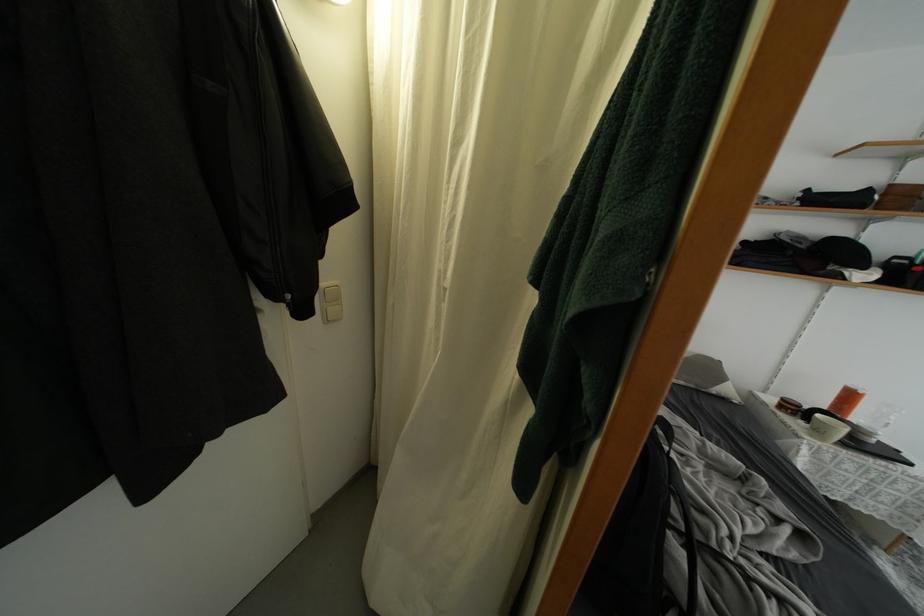
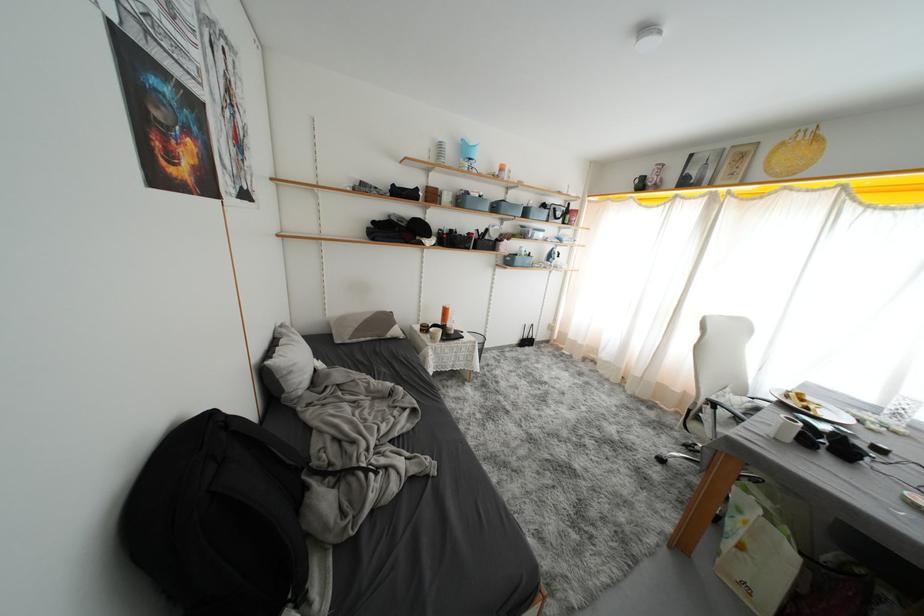
Question: The first image is from the beginning of the video and the second image is from the end. How did the camera likely rotate when shooting the video?

Choices:
 (A) Left
 (B) Right
 (C) Up
 (D) Down

Answer: (B)